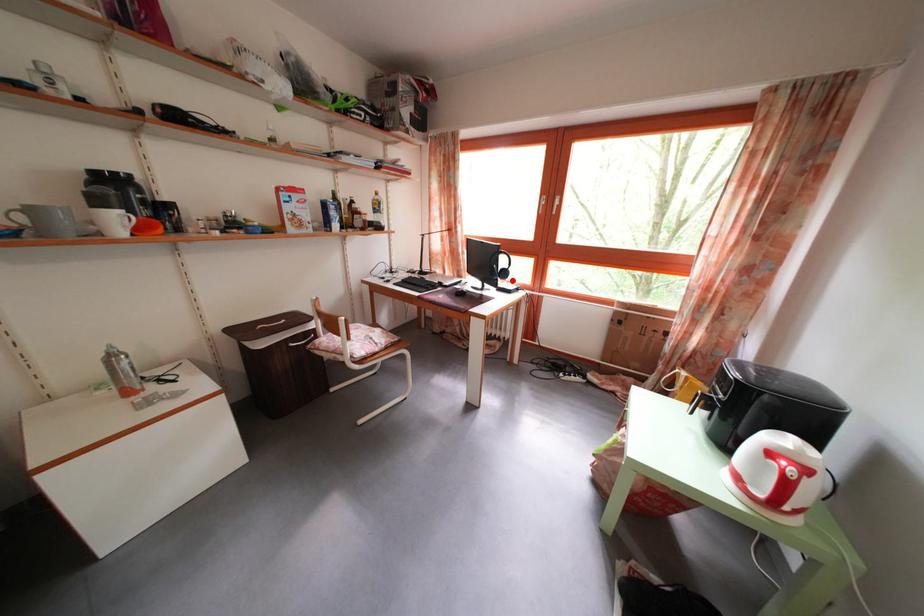
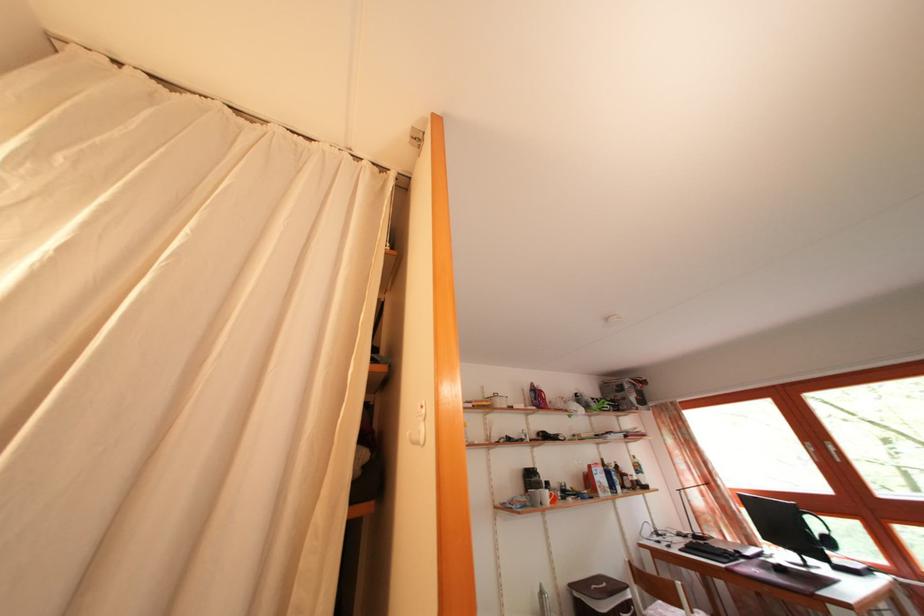
Question: I am providing you with two images of the same scene from different viewpoints. Image1 has a red point marked. In image2, the corresponding 3D location appears at what relative position? Reply with the corresponding letter.

Choices:
 (A) Closer
 (B) Farther

Answer: (A)